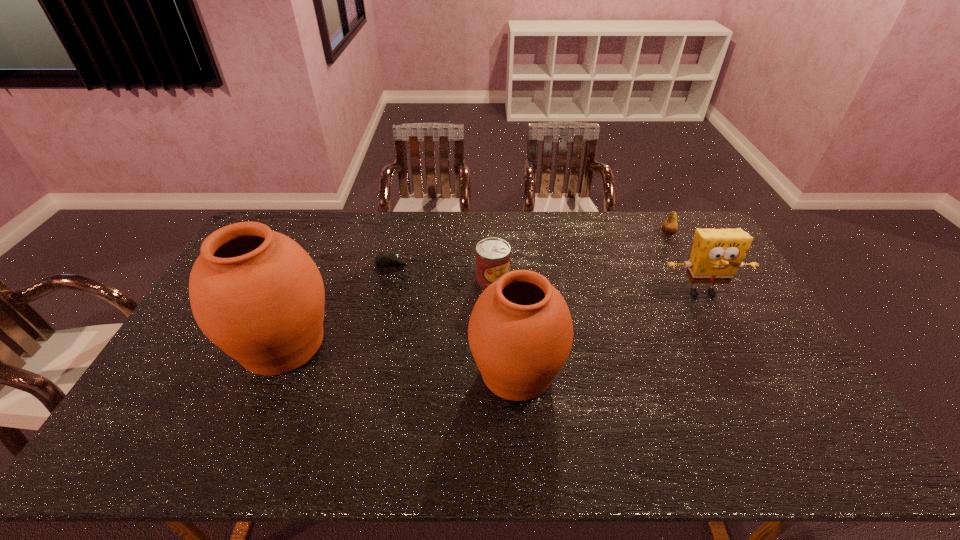
Please point out where to position a new urn on the right to maintain spacing. Please provide its 2D coordinates. Your answer should be formatted as a tuple, i.e. [(x, y)], where the tuple contains the x and y coordinates of a point satisfying the conditions above.

[(780, 403)]